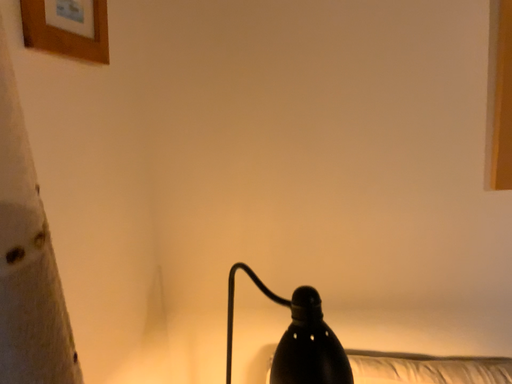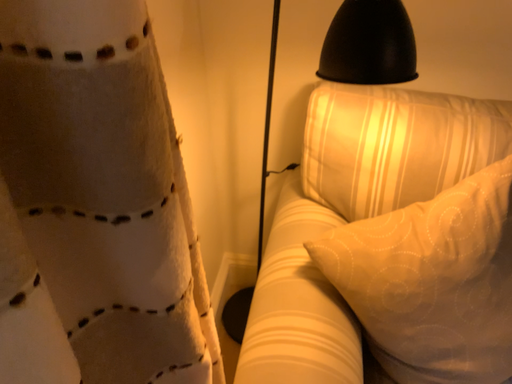
Question: How did the camera likely rotate when shooting the video?

Choices:
 (A) rotated upward
 (B) rotated downward

Answer: (B)